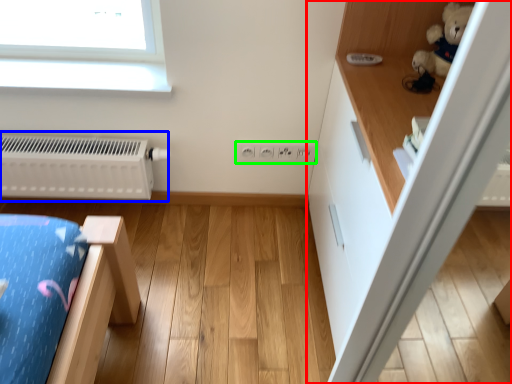
Question: Which is farther away from dresser (highlighted by a red box)? radiator (highlighted by a blue box) or electric outlet (highlighted by a green box)?

Choices:
 (A) radiator
 (B) electric outlet

Answer: (A)